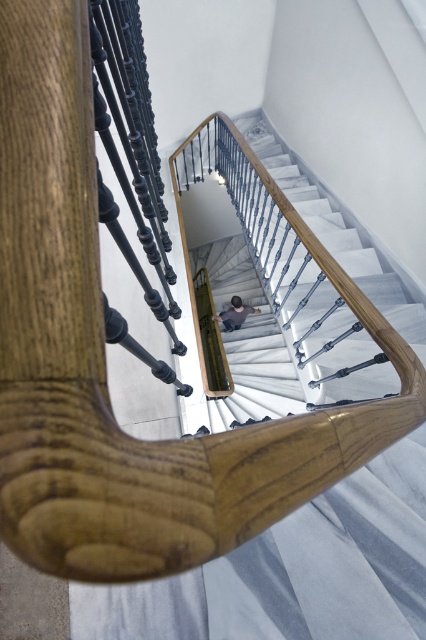
Does white marble stairs at center have a lesser width compared to dark gray shirt at center?

In fact, white marble stairs at center might be wider than dark gray shirt at center.

Between white marble stairs at center and dark gray shirt at center, which one has more height?

With more height is white marble stairs at center.

This screenshot has height=640, width=426. What are the coordinates of `white marble stairs at center` in the screenshot? It's located at (x=247, y=339).

This screenshot has height=640, width=426. In order to click on white marble stairs at center in this screenshot , I will do `click(247, 339)`.